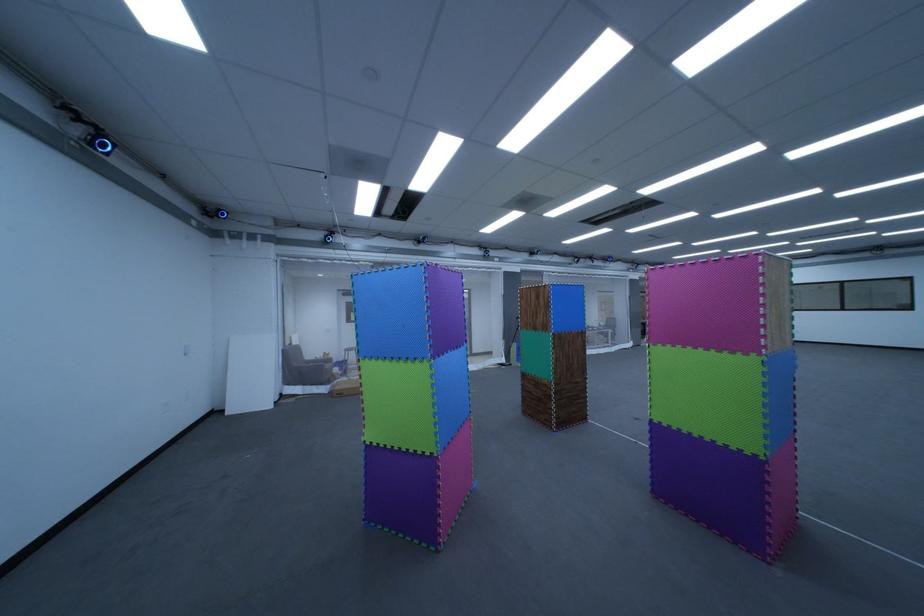
Locate an element on the screen. The height and width of the screenshot is (616, 924). pink foam tile is located at coordinates (721, 304).